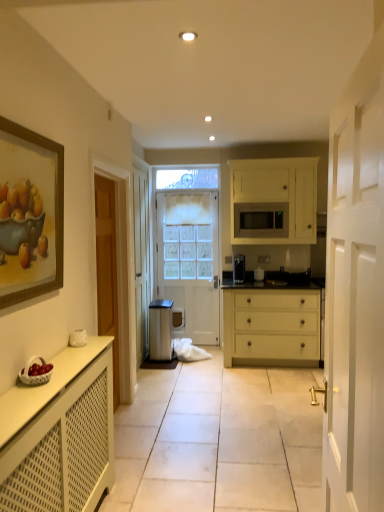
Question: Is point (301, 273) positioned closer to the camera than point (162, 323)?

Choices:
 (A) closer
 (B) farther

Answer: (A)

Question: Considering the relative positions of black glossy sink at center and metallic trash bin at center in the image provided, is black glossy sink at center to the left or to the right of metallic trash bin at center?

Choices:
 (A) left
 (B) right

Answer: (B)

Question: Based on their relative distances, which object is nearer to the white matte screen door at center?

Choices:
 (A) metallic trash bin at center
 (B) white matte drawer at center
 (C) black glossy sink at center
 (D) white matte cabinet at upper right, which is counted as the 1th cabinetry, starting from the back
 (E) gold-framed painting at upper left

Answer: (E)

Question: Based on their relative distances, which object is nearer to the metallic trash bin at center?

Choices:
 (A) white matte screen door at center
 (B) matte black coffee maker at center
 (C) white matte drawer at center
 (D) black glossy sink at center
 (E) gold-framed painting at upper left

Answer: (C)